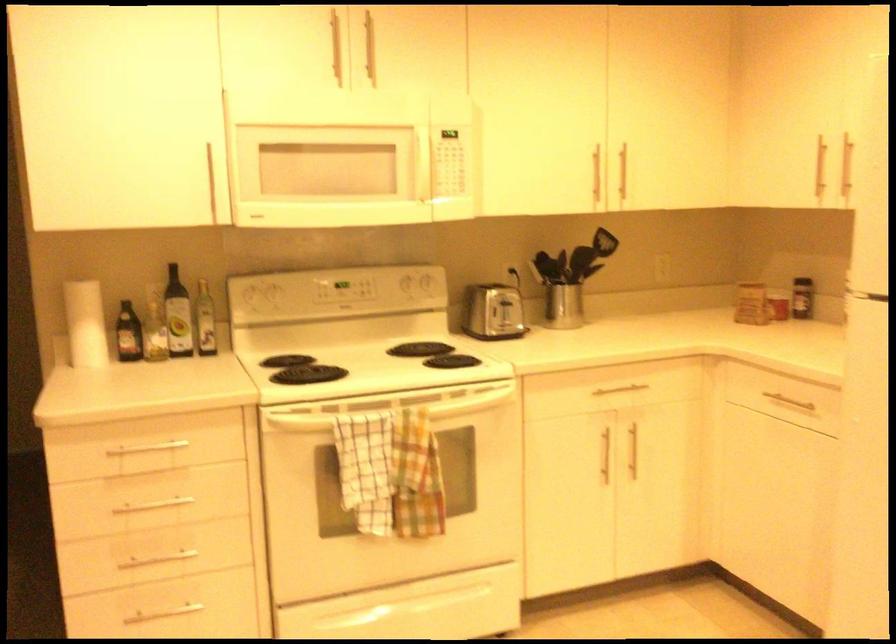
The image size is (896, 644). Describe the element at coordinates (337, 44) in the screenshot. I see `the silver handle` at that location.